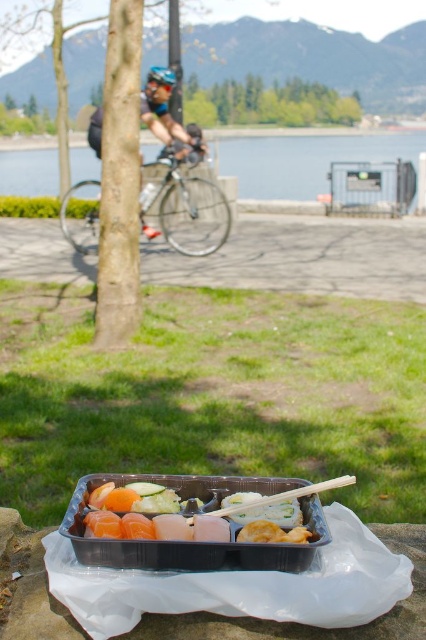
The width and height of the screenshot is (426, 640). Identify the location of shiny metallic bicycle at center. (187, 209).

Does shiny metallic bicycle at center come in front of white plastic chopstick at center?

No, it is not.

The height and width of the screenshot is (640, 426). Find the location of `shiny metallic bicycle at center`. shiny metallic bicycle at center is located at coordinates (187, 209).

The image size is (426, 640). What are the coordinates of `shiny metallic bicycle at center` in the screenshot? It's located at (187, 209).

Is the position of shiny plastic sushi tray at center more distant than that of white plastic chopstick at center?

Yes, it is.

Which is more to the left, shiny plastic sushi tray at center or white plastic chopstick at center?

Positioned to the left is shiny plastic sushi tray at center.

Describe the element at coordinates (161, 516) in the screenshot. Image resolution: width=426 pixels, height=640 pixels. I see `shiny plastic sushi tray at center` at that location.

Locate an element on the screen. This screenshot has width=426, height=640. shiny plastic sushi tray at center is located at coordinates (161, 516).

Does blue water at center have a lesser width compared to shiny metallic bicycle at center?

In fact, blue water at center might be wider than shiny metallic bicycle at center.

Which of these two, blue water at center or shiny metallic bicycle at center, stands taller?

Standing taller between the two is blue water at center.

You are a GUI agent. You are given a task and a screenshot of the screen. Output one action in this format:
    pyautogui.click(x=<x>, y=<y>)
    Task: Click on the blue water at center
    
    Given the screenshot: What is the action you would take?
    click(x=305, y=161)